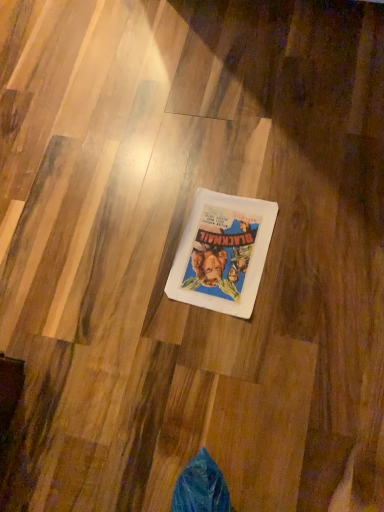
The height and width of the screenshot is (512, 384). I want to click on free location to the right of white matte book cover at center, so click(x=318, y=219).